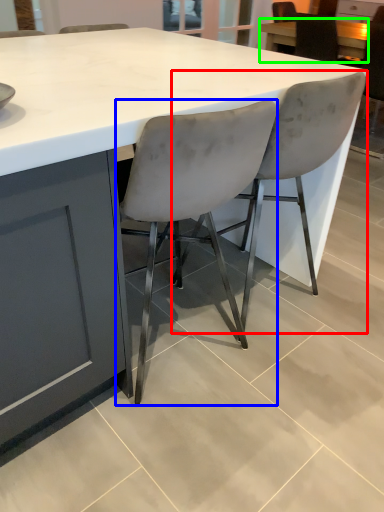
Question: Considering the real-world distances, which object is closest to chair (highlighted by a red box)? chair (highlighted by a blue box) or table (highlighted by a green box).

Choices:
 (A) chair
 (B) table

Answer: (A)